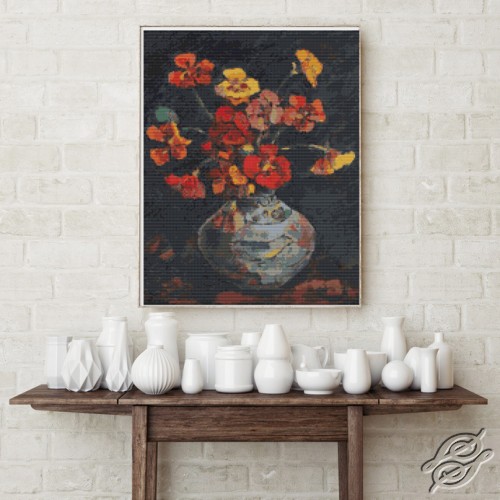
This screenshot has width=500, height=500. Find the location of `vase`. vase is located at coordinates (193, 382).